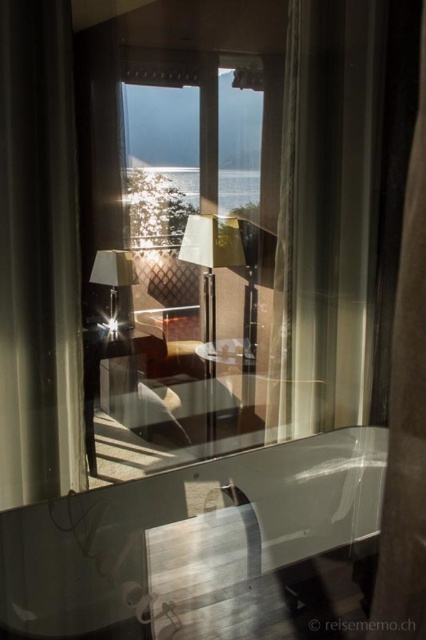
You are a professional decorator who wants to place a decorative vase between the satin beige curtain at left and the satin white curtain at right. The vase has a width of 30 inches. Will it fit between the two curtains without overlapping them?

The satin beige curtain at left and satin white curtain at right are 33.27 inches apart. Since the vase is 30 inches wide, it will fit between them as there is enough space.